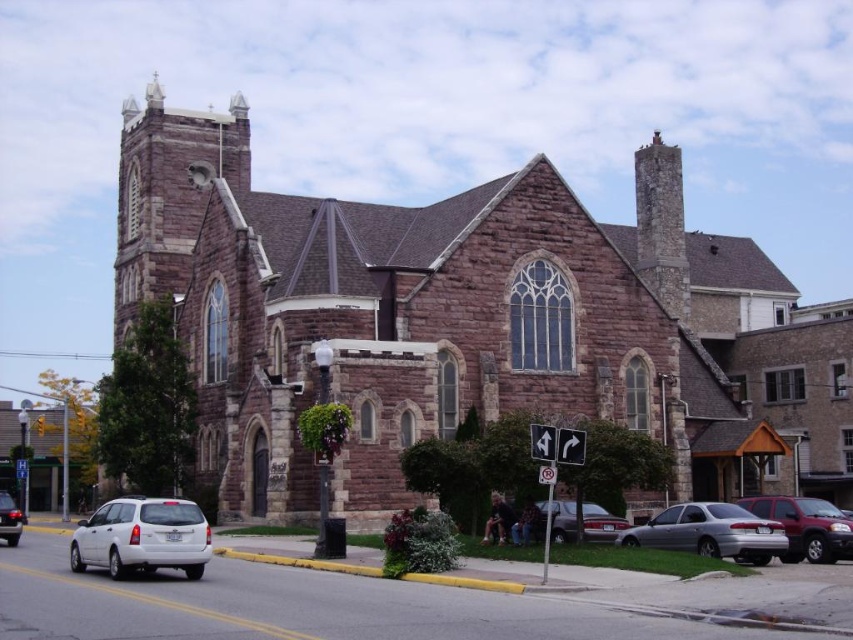
Question: Where is brown stone church at center located in relation to white matte sedan at lower left in the image?

Choices:
 (A) above
 (B) below

Answer: (A)

Question: Is white matte van at lower left closer to the viewer compared to matte red suv at lower right?

Choices:
 (A) yes
 (B) no

Answer: (A)

Question: Which of the following is the closest to the observer?

Choices:
 (A) (144, 564)
 (B) (683, 550)

Answer: (A)

Question: Which object is the closest to the white matte van at lower left?

Choices:
 (A) white matte sedan at lower left
 (B) silver metallic sedan at lower right
 (C) matte silver sedan at lower right
 (D) brown stone church at center

Answer: (A)

Question: Does brown stone church at center have a smaller size compared to white matte van at lower left?

Choices:
 (A) no
 (B) yes

Answer: (A)

Question: Which is farther from the matte silver sedan at lower right?

Choices:
 (A) silver metallic sedan at lower right
 (B) white matte van at lower left
 (C) matte red suv at lower right

Answer: (B)